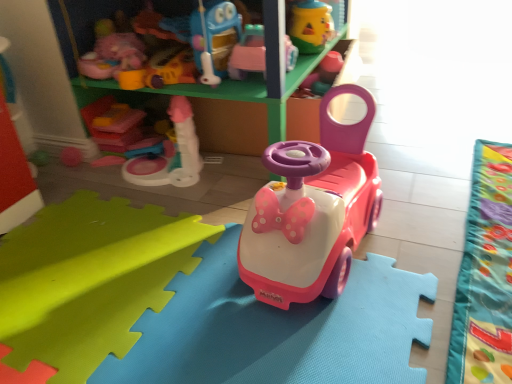
What are the coordinates of `pink plastic toy car at center, which is the second toy in right-to-left order` in the screenshot? It's located at (312, 211).

The image size is (512, 384). Describe the element at coordinates (116, 124) in the screenshot. I see `matte pink plastic toy at center, acting as the first toy starting from the left` at that location.

The width and height of the screenshot is (512, 384). What do you see at coordinates (248, 53) in the screenshot?
I see `pink plastic toy car at center, the 3th toy viewed from the right` at bounding box center [248, 53].

Measure the distance between matte pink plastic walker at upper center, the second toy viewed from the left, and camera.

The distance of matte pink plastic walker at upper center, the second toy viewed from the left, from camera is 1.13 meters.

You are a GUI agent. You are given a task and a screenshot of the screen. Output one action in this format:
    pyautogui.click(x=<x>, y=<y>)
    Task: Click on the pink plastic toy car at center, positioned as the fourth toy in left-to-right order
    The width and height of the screenshot is (512, 384).
    Given the screenshot: What is the action you would take?
    pyautogui.click(x=312, y=211)

Would you say green plastic shelf at upper center is inside or outside matte pink plastic walker at upper center, which is the fourth toy from right to left?

green plastic shelf at upper center is not inside matte pink plastic walker at upper center, which is the fourth toy from right to left, it's outside.

Looking at this image, can you confirm if green plastic shelf at upper center is smaller than matte pink plastic walker at upper center, which is the fourth toy from right to left?

Incorrect, green plastic shelf at upper center is not smaller in size than matte pink plastic walker at upper center, which is the fourth toy from right to left.

Where is `shelf on the right side of matte pink plastic walker at upper center, which is the fourth toy from right to left`? This screenshot has width=512, height=384. shelf on the right side of matte pink plastic walker at upper center, which is the fourth toy from right to left is located at coordinates (250, 112).

From a real-world perspective, which toy is the 2nd one above the matte pink plastic toy at center, the 5th toy positioned from the right? Please provide its 2D coordinates.

[(248, 53)]

Does matte pink plastic toy at center, acting as the first toy starting from the left, appear on the left side of pink plastic toy car at center, the 3th toy viewed from the right?

Yes, matte pink plastic toy at center, acting as the first toy starting from the left, is to the left of pink plastic toy car at center, the 3th toy viewed from the right.

Considering the positions of points (131, 135) and (291, 49), is point (131, 135) closer to camera compared to point (291, 49)?

No, it is not.

Can you tell me how much green plastic shelf at upper center and pink plastic toy car at center, which is the second toy in right-to-left order, differ in facing direction?

The angular difference between green plastic shelf at upper center and pink plastic toy car at center, which is the second toy in right-to-left order, is 4.78 degrees.

This screenshot has width=512, height=384. I want to click on shelf that is on the left side of pink plastic toy car at center, positioned as the fourth toy in left-to-right order, so click(250, 112).

Does green plastic shelf at upper center appear on the left side of pink plastic toy car at center, positioned as the fourth toy in left-to-right order?

Yes.

Which is nearer, (313, 63) or (267, 218)?

The point (267, 218) is in front.

Is green plastic shelf at upper center not close to rubber duck at upper center, the fifth toy positioned from the left?

No.

Considering the sizes of objects green plastic shelf at upper center and rubber duck at upper center, the fifth toy positioned from the left, in the image provided, who is shorter, green plastic shelf at upper center or rubber duck at upper center, the fifth toy positioned from the left,?

rubber duck at upper center, the fifth toy positioned from the left, is shorter.

From a real-world perspective, relative to rubber duck at upper center, the fifth toy positioned from the left, is green plastic shelf at upper center vertically above or below?

green plastic shelf at upper center is situated lower than rubber duck at upper center, the fifth toy positioned from the left, in the real world.

From the image's perspective, is green plastic shelf at upper center located above or below rubber duck at upper center, the 1th toy viewed from the right?

Based on their image positions, green plastic shelf at upper center is located beneath rubber duck at upper center, the 1th toy viewed from the right.

Can you tell me how much matte pink plastic walker at upper center, which is the fourth toy from right to left, and matte pink plastic toy at center, the 5th toy positioned from the right, differ in facing direction?

They differ by 90.8 degrees in their facing directions.

Between matte pink plastic walker at upper center, the second toy viewed from the left, and matte pink plastic toy at center, acting as the first toy starting from the left, which one has smaller width?

Thinner between the two is matte pink plastic toy at center, acting as the first toy starting from the left.

You are a GUI agent. You are given a task and a screenshot of the screen. Output one action in this format:
    pyautogui.click(x=<x>, y=<y>)
    Task: Click on the toy that is the 4th one below the matte pink plastic walker at upper center, which is the fourth toy from right to left (from a real-world perspective)
    This screenshot has width=512, height=384.
    Given the screenshot: What is the action you would take?
    pyautogui.click(x=116, y=124)

Could you tell me if matte pink plastic walker at upper center, which is the fourth toy from right to left, is turned towards matte pink plastic toy at center, acting as the first toy starting from the left?

No, matte pink plastic walker at upper center, which is the fourth toy from right to left, is not aimed at matte pink plastic toy at center, acting as the first toy starting from the left.

Identify the location of shelf located above the pink plastic toy car at center, arranged as the 3th toy when viewed from the left (from the image's perspective). The height and width of the screenshot is (384, 512). (250, 112).

Is pink plastic toy car at center, arranged as the 3th toy when viewed from the left, aimed at green plastic shelf at upper center?

Yes, pink plastic toy car at center, arranged as the 3th toy when viewed from the left, is facing green plastic shelf at upper center.

What's the angular difference between pink plastic toy car at center, arranged as the 3th toy when viewed from the left, and green plastic shelf at upper center's facing directions?

The angular difference between pink plastic toy car at center, arranged as the 3th toy when viewed from the left, and green plastic shelf at upper center is 0.00178 degrees.

Does pink plastic toy car at center, which is the second toy in right-to-left order, have a smaller size compared to green plastic shelf at upper center?

Yes.

Is pink plastic toy car at center, which is the second toy in right-to-left order, not near green plastic shelf at upper center?

No, there isn't a large distance between pink plastic toy car at center, which is the second toy in right-to-left order, and green plastic shelf at upper center.

Does pink plastic toy car at center, which is the second toy in right-to-left order, turn towards green plastic shelf at upper center?

No, pink plastic toy car at center, which is the second toy in right-to-left order, is not turned towards green plastic shelf at upper center.

Considering their positions, is pink plastic toy car at center, which is the second toy in right-to-left order, located in front of or behind green plastic shelf at upper center?

pink plastic toy car at center, which is the second toy in right-to-left order, is in front of green plastic shelf at upper center.

Find the location of a particular element. toy that is the 1st one when counting downward from the green plastic shelf at upper center (from the image's perspective) is located at coordinates (142, 79).

Starting from the matte pink plastic toy at center, the 5th toy positioned from the right, which toy is the 2nd one in front? Please provide its 2D coordinates.

[(248, 53)]

Estimate the real-world distances between objects in this image. Which object is further from matte pink plastic toy at center, the 5th toy positioned from the right, pink plastic toy car at center, the 3th toy viewed from the right, or matte pink plastic walker at upper center, the second toy viewed from the left?

Based on the image, pink plastic toy car at center, the 3th toy viewed from the right, appears to be further to matte pink plastic toy at center, the 5th toy positioned from the right.

Looking at the image, which one is located further to velvet green blanket at lower right, pink plastic toy car at center, positioned as the fourth toy in left-to-right order, or pink plastic toy car at center, arranged as the 3th toy when viewed from the left?

pink plastic toy car at center, arranged as the 3th toy when viewed from the left.

Looking at the image, which one is located further to green plastic shelf at upper center, pink plastic toy car at center, the 3th toy viewed from the right, or matte pink plastic toy at center, acting as the first toy starting from the left?

Based on the image, matte pink plastic toy at center, acting as the first toy starting from the left, appears to be further to green plastic shelf at upper center.

When comparing their distances from matte pink plastic walker at upper center, which is the fourth toy from right to left, does green plastic shelf at upper center or pink plastic toy car at center, arranged as the 3th toy when viewed from the left, seem further?

green plastic shelf at upper center is further to matte pink plastic walker at upper center, which is the fourth toy from right to left.

Looking at this image, looking at the image, which one is located closer to velvet green blanket at lower right, pink plastic toy car at center, arranged as the 3th toy when viewed from the left, or pink plastic toy car at center, positioned as the fourth toy in left-to-right order?

The object closer to velvet green blanket at lower right is pink plastic toy car at center, positioned as the fourth toy in left-to-right order.

From the image, which object appears to be farther from green plastic shelf at upper center, pink plastic toy car at center, arranged as the 3th toy when viewed from the left, or pink plastic toy car at center, positioned as the fourth toy in left-to-right order?

pink plastic toy car at center, positioned as the fourth toy in left-to-right order.

When comparing their distances from pink plastic toy car at center, arranged as the 3th toy when viewed from the left, does matte pink plastic toy at center, acting as the first toy starting from the left, or green plastic shelf at upper center seem closer?

The object closer to pink plastic toy car at center, arranged as the 3th toy when viewed from the left, is green plastic shelf at upper center.

Which object lies further to the anchor point green plastic shelf at upper center, pink plastic toy car at center, which is the second toy in right-to-left order, or rubber duck at upper center, the 1th toy viewed from the right?

Among the two, pink plastic toy car at center, which is the second toy in right-to-left order, is located further to green plastic shelf at upper center.

The width and height of the screenshot is (512, 384). What are the coordinates of `shelf between matte pink plastic toy at center, acting as the first toy starting from the left, and pink plastic toy car at center, the 3th toy viewed from the right, in the horizontal direction` in the screenshot? It's located at pyautogui.click(x=250, y=112).

Find the location of `toy located between pink plastic toy car at center, which is the second toy in right-to-left order, and pink plastic toy car at center, arranged as the 3th toy when viewed from the left, in the depth direction`. toy located between pink plastic toy car at center, which is the second toy in right-to-left order, and pink plastic toy car at center, arranged as the 3th toy when viewed from the left, in the depth direction is located at coordinates (142, 79).

The height and width of the screenshot is (384, 512). Identify the location of toy situated between matte pink plastic toy at center, acting as the first toy starting from the left, and pink plastic toy car at center, the 3th toy viewed from the right, from left to right. (142, 79).

I want to click on blanket between pink plastic toy car at center, positioned as the fourth toy in left-to-right order, and rubber duck at upper center, the 1th toy viewed from the right, along the z-axis, so pos(485,274).